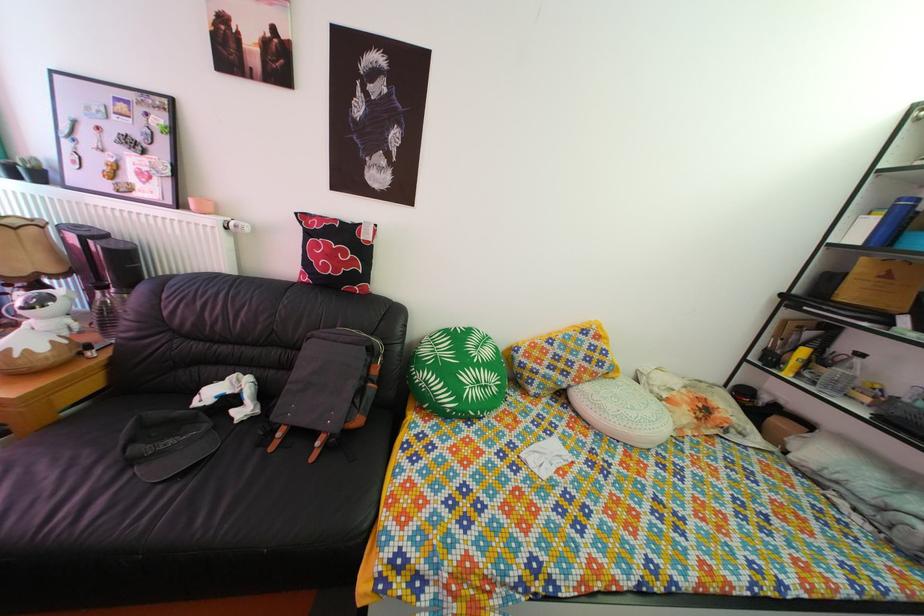
At what (x,y) coordinates should I click in order to perform the action: click on black sofa sitting surface. Please return your answer as a coordinate pair (x, y). Image resolution: width=924 pixels, height=616 pixels. Looking at the image, I should click on (164, 491).